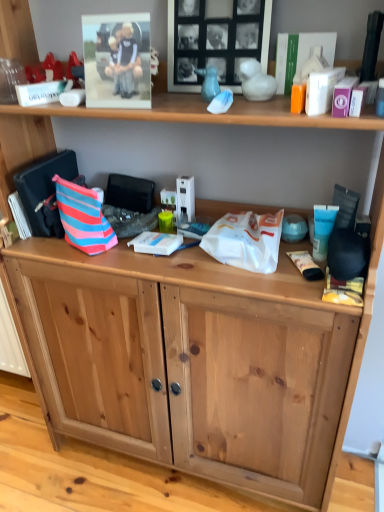
Question: Considering their positions, is white plastic bag at center located in front of or behind natural wood cabinet at lower center?

Choices:
 (A) behind
 (B) front

Answer: (B)

Question: From a real-world perspective, is white plastic bag at center positioned above or below natural wood cabinet at lower center?

Choices:
 (A) above
 (B) below

Answer: (A)

Question: Estimate the real-world distances between objects in this image. Which object is farther from the white plastic book at center, which is the 3th book in top-to-bottom order?

Choices:
 (A) white matte book at upper right, arranged as the 3th book when ordered from the bottom
 (B) blue cream tube at right
 (C) striped fabric book at left, the third book when ordered from right to left
 (D) white plastic bag at center
 (E) striped fabric handbag at left

Answer: (A)

Question: Which object is positioned closest to the natural wood cabinet at lower center?

Choices:
 (A) striped fabric handbag at left
 (B) white matte book at upper right, which is the first book in top-to-bottom order
 (C) striped fabric messenger bag at left
 (D) striped fabric book at left, the first book from the left
 (E) white plastic book at center, positioned as the first book in bottom-to-top order

Answer: (A)